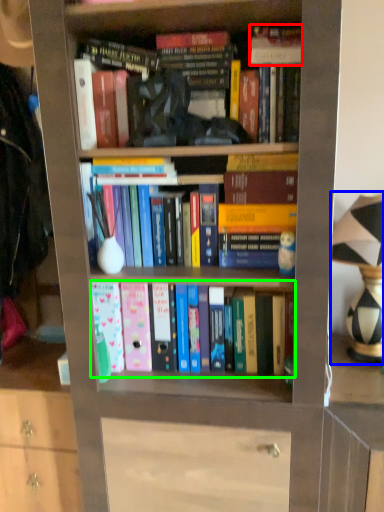
Question: Which object is the closest to the book (highlighted by a red box)? Choose among these: table lamp (highlighted by a blue box) or book (highlighted by a green box).

Choices:
 (A) table lamp
 (B) book

Answer: (A)